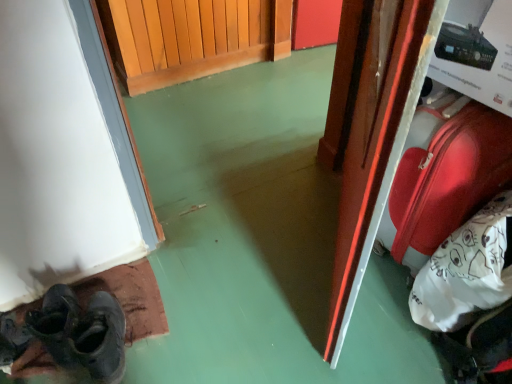
This screenshot has width=512, height=384. In order to click on vacant point to the left of glossy wood door at right in this screenshot , I will do pyautogui.click(x=256, y=269).